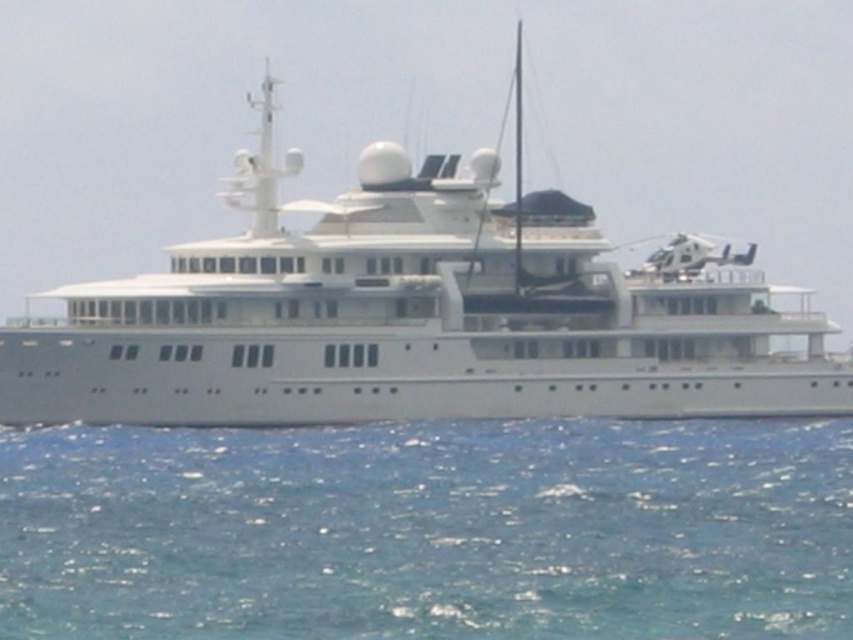
Question: Is blue water at lower center thinner than white glossy cruise ship at center?

Choices:
 (A) no
 (B) yes

Answer: (B)

Question: Observing the image, what is the correct spatial positioning of blue water at lower center in reference to white glossy cruise ship at center?

Choices:
 (A) below
 (B) above

Answer: (A)

Question: Which point is farther to the camera?

Choices:
 (A) blue water at lower center
 (B) white glossy cruise ship at center

Answer: (B)

Question: From the image, what is the correct spatial relationship of blue water at lower center in relation to white glossy cruise ship at center?

Choices:
 (A) right
 (B) left

Answer: (A)

Question: Which point is closer to the camera?

Choices:
 (A) (479, 412)
 (B) (80, 520)

Answer: (B)

Question: Which object is farther from the camera taking this photo?

Choices:
 (A) blue water at lower center
 (B) white glossy cruise ship at center

Answer: (B)